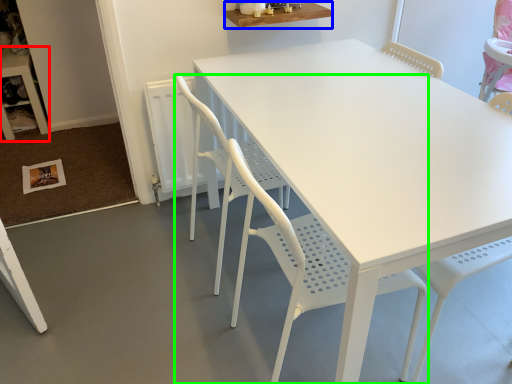
Question: Considering the real-world distances, which object is farthest from table (highlighted by a red box)? table (highlighted by a blue box) or chair (highlighted by a green box)?

Choices:
 (A) table
 (B) chair

Answer: (B)